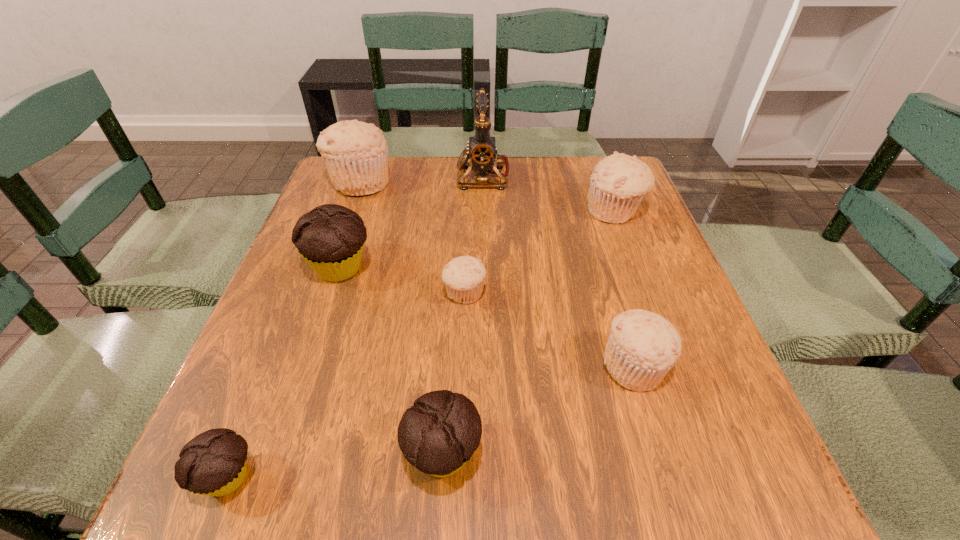
This screenshot has height=540, width=960. Identify the location of the smallest beige muffin. (463, 276).

Where is `the smallest chocolate muffin`? The image size is (960, 540). the smallest chocolate muffin is located at coordinates (213, 463).

At what (x,y) coordinates should I click in order to perform the action: click on vacant space located 0.350m on the front of the tallest object, featuring the rotary dial. Please return your answer as a coordinate pair (x, y). The width and height of the screenshot is (960, 540). Looking at the image, I should click on (332, 176).

I want to click on free space located 0.210m on the front of the tallest object, featuring the rotary dial, so click(382, 176).

The height and width of the screenshot is (540, 960). In order to click on vacant space located 0.170m on the front of the tallest object, featuring the rotary dial in this screenshot , I will do `click(396, 176)`.

The height and width of the screenshot is (540, 960). I want to click on free space located on the right of the tallest muffin, so click(480, 182).

Find the location of a particular element. vacant space located on the front of the third smallest beige muffin is located at coordinates (632, 256).

Find the location of a particular element. Image resolution: width=960 pixels, height=540 pixels. free spot located on the back of the farthest chocolate muffin is located at coordinates (362, 202).

The image size is (960, 540). In order to click on free spot located 0.110m on the back of the sixth farthest object in this screenshot , I will do `click(614, 297)`.

Where is `free spot located on the left of the second smallest chocolate muffin`? The height and width of the screenshot is (540, 960). free spot located on the left of the second smallest chocolate muffin is located at coordinates (205, 455).